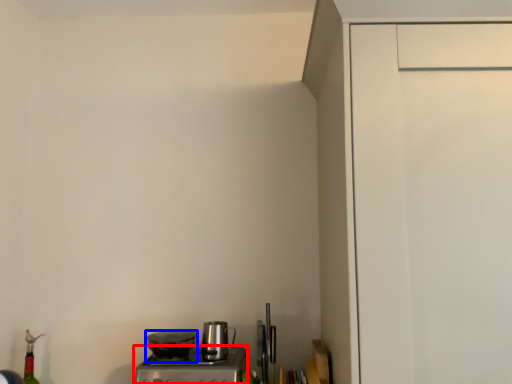
Question: Which object is closer to the camera taking this photo, home appliance (highlighted by a red box) or kitchen appliance (highlighted by a blue box)?

Choices:
 (A) home appliance
 (B) kitchen appliance

Answer: (A)